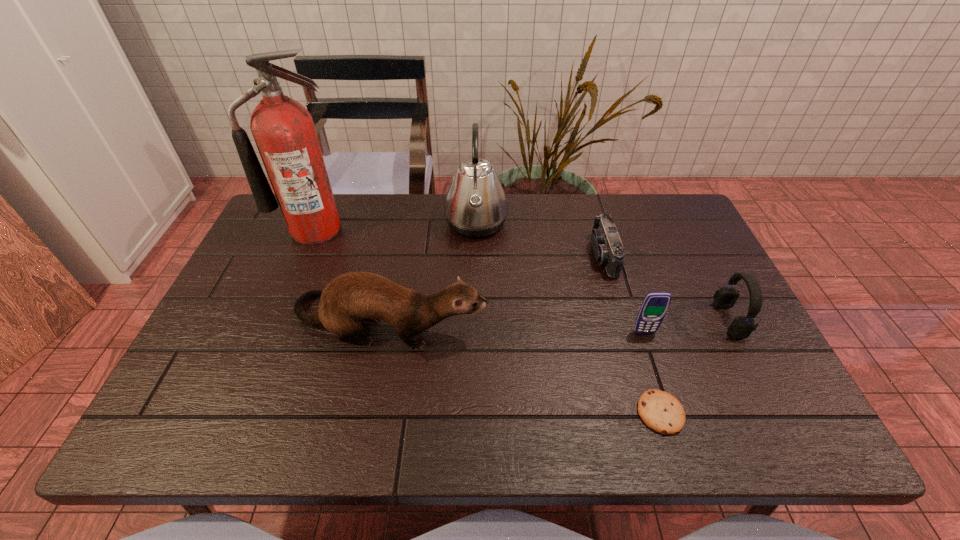
You are a GUI agent. You are given a task and a screenshot of the screen. Output one action in this format:
    pyautogui.click(x=<x>, y=<y>)
    Task: Click on the vacant region between the camcorder and the third tallest object
    This screenshot has width=960, height=540.
    Given the screenshot: What is the action you would take?
    [496, 288]

Select which object appears as the third closest to the fifth shortest object. Please provide its 2D coordinates. Your answer should be formatted as a tuple, i.e. [(x, y)], where the tuple contains the x and y coordinates of a point satisfying the conditions above.

[(606, 243)]

Select which object is the third closest to the camcorder. Please provide its 2D coordinates. Your answer should be formatted as a tuple, i.e. [(x, y)], where the tuple contains the x and y coordinates of a point satisfying the conditions above.

[(475, 206)]

Where is `free space that satisfies the following two spatial constraints: 1. on the headband of the headset; 2. on the front-facing side of the cellular telephone`? Image resolution: width=960 pixels, height=540 pixels. free space that satisfies the following two spatial constraints: 1. on the headband of the headset; 2. on the front-facing side of the cellular telephone is located at coordinates (735, 333).

At what (x,y) coordinates should I click in order to perform the action: click on blank area in the image that satisfies the following two spatial constraints: 1. on the back side of the nearest object; 2. from the spout of the kettle. Please return your answer as a coordinate pair (x, y). The image size is (960, 540). Looking at the image, I should click on (601, 223).

The image size is (960, 540). I want to click on vacant area that satisfies the following two spatial constraints: 1. at the face of the third tallest object; 2. on the left side of the shortest object, so click(372, 413).

This screenshot has height=540, width=960. Find the location of `free spot that satisfies the following two spatial constraints: 1. from the spout of the kettle; 2. on the left side of the shortest object`. free spot that satisfies the following two spatial constraints: 1. from the spout of the kettle; 2. on the left side of the shortest object is located at coordinates (474, 413).

Identify the location of free space that satisfies the following two spatial constraints: 1. on the headband of the headset; 2. on the front-facing side of the cellular telephone. click(735, 333).